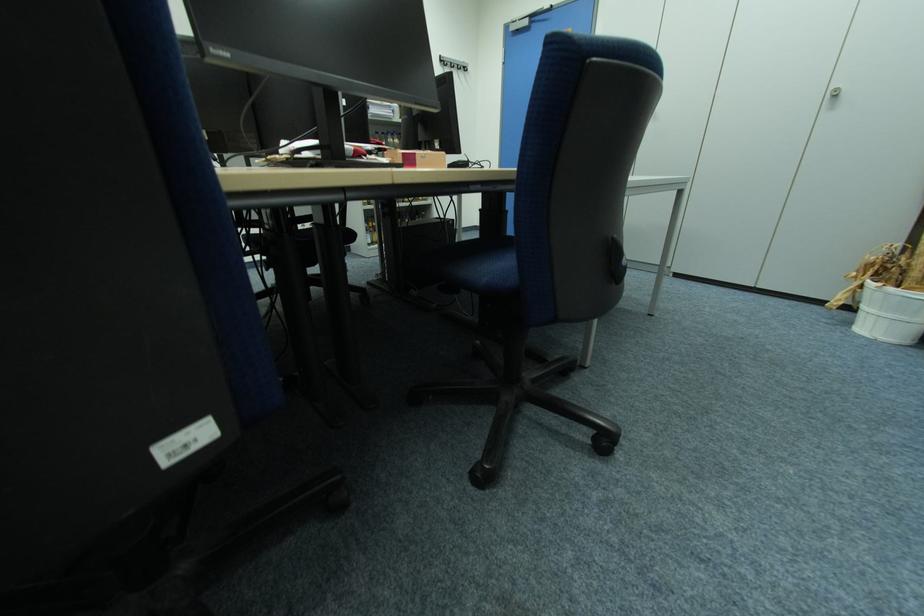
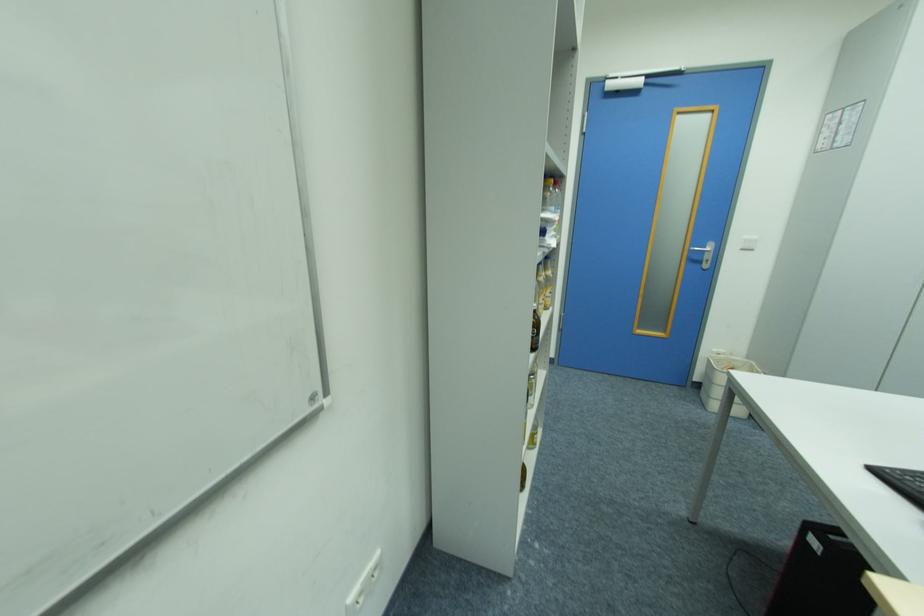
Which direction would the cameraman need to move to produce the second image?

The movement direction of the cameraman is left, forward.